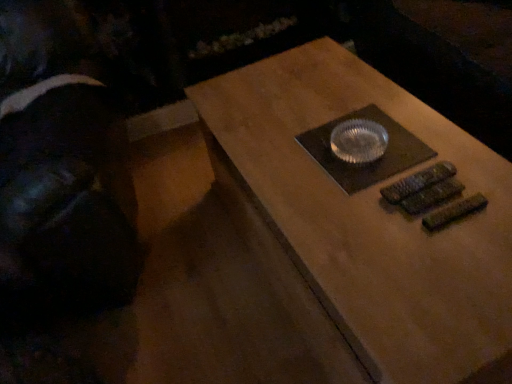
Locate an element on the screen. This screenshot has height=384, width=512. vacant space situated above matte brown table at center (from a real-world perspective) is located at coordinates (376, 182).